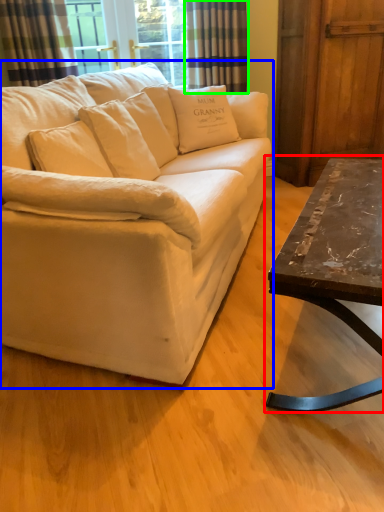
Question: Which object is the farthest from coffee table (highlighted by a red box)? Choose among these: studio couch (highlighted by a blue box) or curtain (highlighted by a green box).

Choices:
 (A) studio couch
 (B) curtain

Answer: (B)